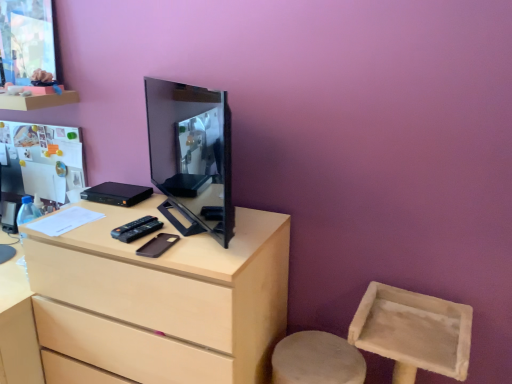
The width and height of the screenshot is (512, 384). Find the location of `blank area beneath black glossy monitor at center (from a real-world perspective)`. blank area beneath black glossy monitor at center (from a real-world perspective) is located at coordinates (180, 216).